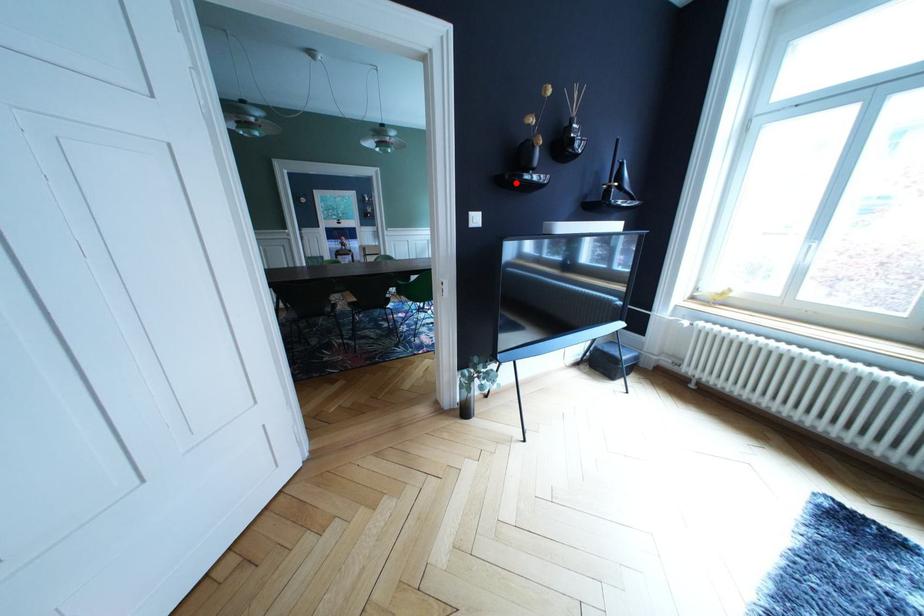
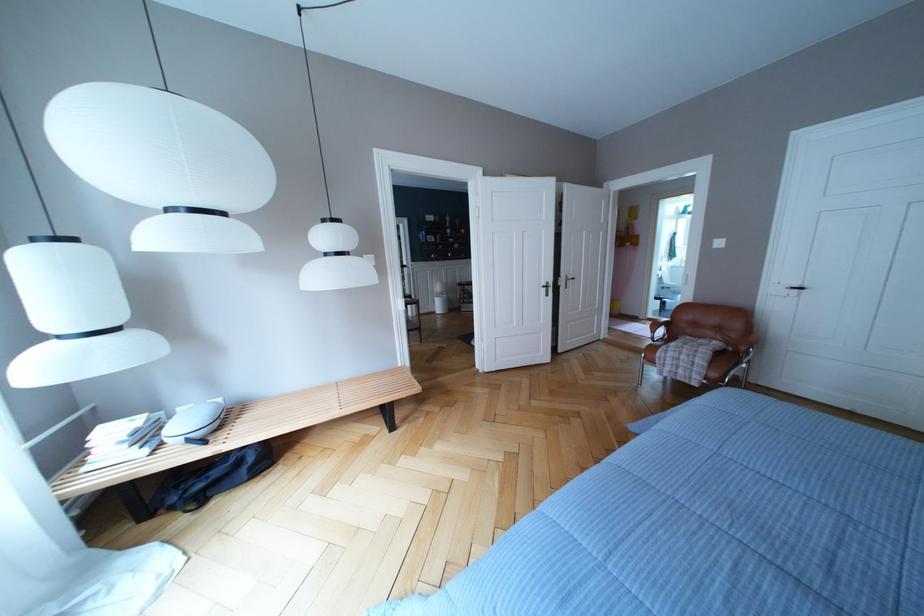
Question: I am providing you with two images of the same scene from different viewpoints. A red point is marked on the first image. Can you still see the location of the red point in image 2?

Choices:
 (A) Yes
 (B) No

Answer: (B)